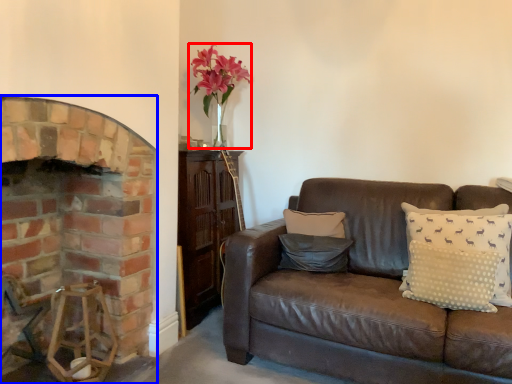
Question: Which object is closer to the camera taking this photo, floral arrangement (highlighted by a red box) or fireplace (highlighted by a blue box)?

Choices:
 (A) floral arrangement
 (B) fireplace

Answer: (B)